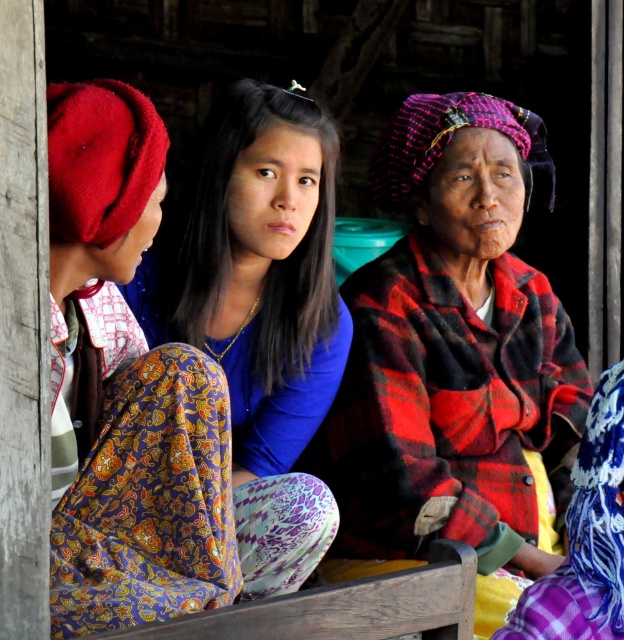
Can you confirm if plaid fabric shawl at right is shorter than matte red beret at left?

No, plaid fabric shawl at right is not shorter than matte red beret at left.

From the picture: Who is more forward, (475, 481) or (76, 189)?

Point (76, 189) is more forward.

This screenshot has width=624, height=640. What do you see at coordinates (454, 348) in the screenshot? I see `plaid fabric shawl at right` at bounding box center [454, 348].

I want to click on plaid fabric shawl at right, so pos(454,348).

Based on the photo, which of these two, plaid fabric shawl at right or matte blue blouse at center, stands shorter?

matte blue blouse at center is shorter.

Which is in front, point (383, 160) or point (285, 278)?

Point (285, 278) is more forward.

Describe the element at coordinates (454, 348) in the screenshot. I see `plaid fabric shawl at right` at that location.

The image size is (624, 640). I want to click on plaid fabric shawl at right, so click(454, 348).

Is matte red beret at left positioned behind matte blue blouse at center?

No, it is not.

Is matte red beret at left wider than matte blue blouse at center?

Incorrect, matte red beret at left's width does not surpass matte blue blouse at center's.

Describe the element at coordinates (129, 388) in the screenshot. I see `matte red beret at left` at that location.

At what (x,y) coordinates should I click in order to perform the action: click on matte red beret at left. Please return your answer as a coordinate pair (x, y). The image size is (624, 640). Looking at the image, I should click on (129, 388).